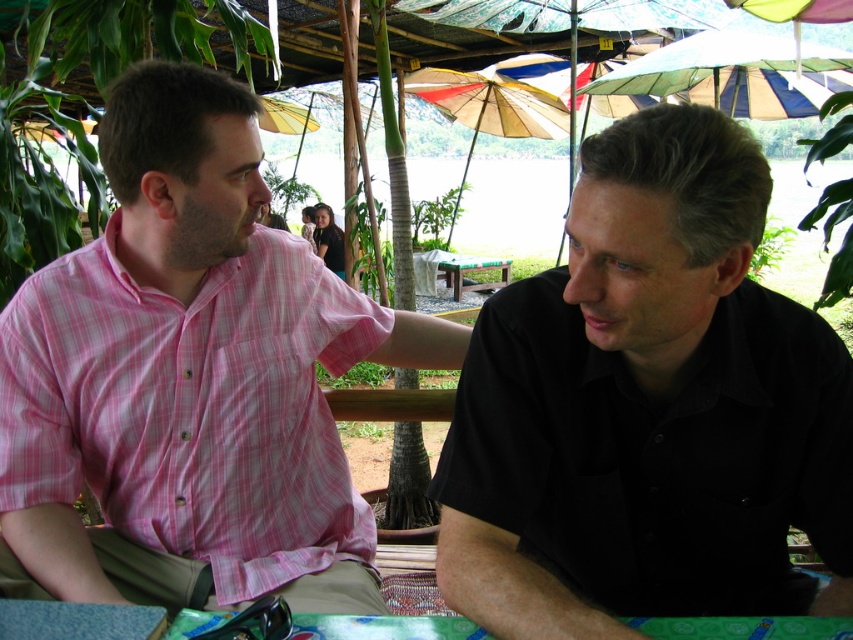
You are a photographer trying to capture a candid shot of both the black matte shirt at right and the pink checkered shirt at left. Since you want to ensure both subjects are in focus, you need to know their heights to adjust your camera settings. Which person is taller?

The pink checkered shirt at left is taller than the black matte shirt at right, so you should adjust your camera settings accordingly to account for their different heights.